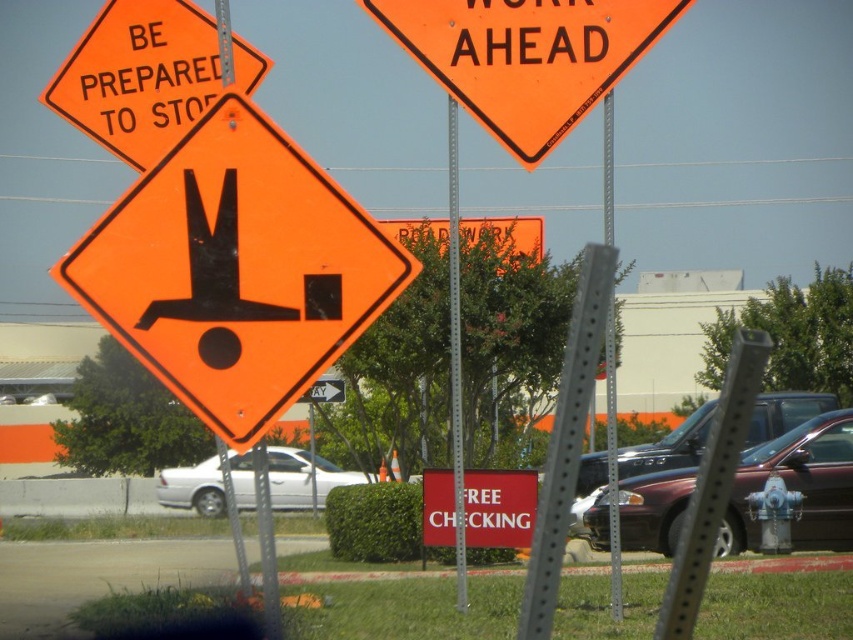
Does orange reflective diamond at center have a greater width compared to red matte sign at center?

Yes.

Is point (331, 308) positioned behind point (485, 483)?

No, it is not.

The height and width of the screenshot is (640, 853). In order to click on orange reflective diamond at center in this screenshot , I will do `click(235, 269)`.

Which is above, orange reflective diamond-shaped sign at upper left or maroon metallic sedan at center-right?

orange reflective diamond-shaped sign at upper left is above.

Is orange reflective diamond-shaped sign at upper left wider than maroon metallic sedan at center-right?

Yes.

Is point (215, 33) behind point (682, 468)?

No, it is in front of (682, 468).

The height and width of the screenshot is (640, 853). Identify the location of orange reflective diamond-shaped sign at upper left. (148, 76).

Is orange reflective diamond-shaped sign at upper left thinner than metallic gray pole at center?

No, orange reflective diamond-shaped sign at upper left is not thinner than metallic gray pole at center.

Can you confirm if orange reflective diamond-shaped sign at upper left is positioned above metallic gray pole at center?

Incorrect, orange reflective diamond-shaped sign at upper left is not positioned above metallic gray pole at center.

Which is behind, point (113, 65) or point (457, 380)?

Point (113, 65)

At what (x,y) coordinates should I click in order to perform the action: click on orange reflective diamond-shaped sign at upper left. Please return your answer as a coordinate pair (x, y). This screenshot has height=640, width=853. Looking at the image, I should click on (148, 76).